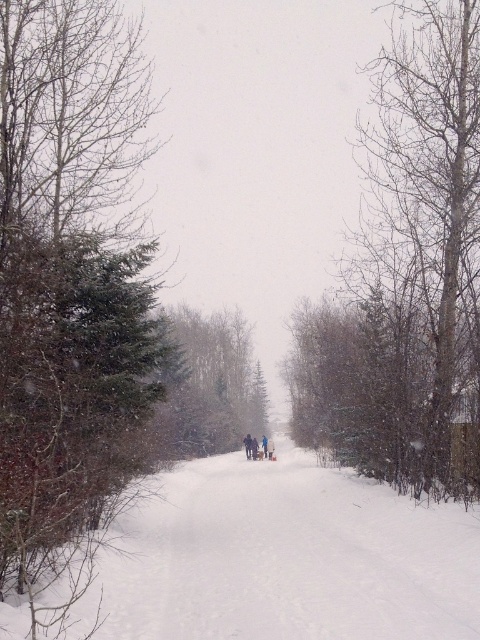
Does bare wood tree at right appear under green matte tree at center?

Actually, bare wood tree at right is above green matte tree at center.

The width and height of the screenshot is (480, 640). In order to click on bare wood tree at right in this screenshot , I will do [407, 273].

Is green textured evergreen at left positioned at the back of green matte tree at center?

No, it is in front of green matte tree at center.

I want to click on green textured evergreen at left, so click(68, 260).

Who is more forward, (69, 234) or (166, 372)?

Point (69, 234) is more forward.

This screenshot has width=480, height=640. I want to click on green textured evergreen at left, so click(68, 260).

Between green textured evergreen at left and bare wood tree at right, which one appears on the right side from the viewer's perspective?

bare wood tree at right

Is green textured evergreen at left positioned behind bare wood tree at right?

No.

Describe the element at coordinates (68, 260) in the screenshot. I see `green textured evergreen at left` at that location.

Find the location of a particular element. green textured evergreen at left is located at coordinates (68, 260).